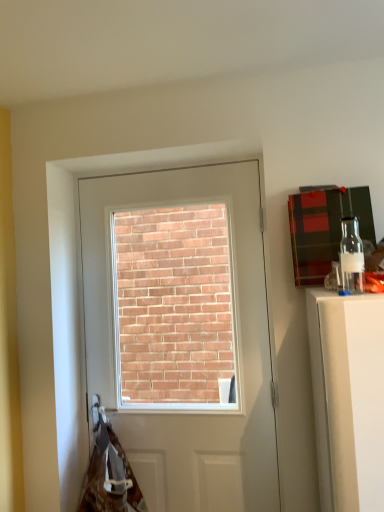
Question: Can you confirm if white glossy door at center is shorter than clear glass bottle at upper right?

Choices:
 (A) no
 (B) yes

Answer: (A)

Question: Does white glossy door at center lie in front of clear glass bottle at upper right?

Choices:
 (A) yes
 (B) no

Answer: (B)

Question: Is white glossy door at center turned away from clear glass bottle at upper right?

Choices:
 (A) no
 (B) yes

Answer: (A)

Question: Can you confirm if white glossy door at center is wider than clear glass bottle at upper right?

Choices:
 (A) yes
 (B) no

Answer: (A)

Question: From the image's perspective, is white glossy door at center above clear glass bottle at upper right?

Choices:
 (A) no
 (B) yes

Answer: (A)

Question: From a real-world perspective, is white glossy door at center positioned over clear glass bottle at upper right based on gravity?

Choices:
 (A) no
 (B) yes

Answer: (A)

Question: Is clear glass bottle at upper right looking in the opposite direction of brown fabric at lower left?

Choices:
 (A) yes
 (B) no

Answer: (B)

Question: From a real-world perspective, is clear glass bottle at upper right located beneath brown fabric at lower left?

Choices:
 (A) yes
 (B) no

Answer: (B)

Question: Considering the relative positions of clear glass bottle at upper right and brown fabric at lower left in the image provided, is clear glass bottle at upper right behind brown fabric at lower left?

Choices:
 (A) no
 (B) yes

Answer: (A)

Question: Is clear glass bottle at upper right beside brown fabric at lower left?

Choices:
 (A) no
 (B) yes

Answer: (A)

Question: Are clear glass bottle at upper right and brown fabric at lower left far apart?

Choices:
 (A) no
 (B) yes

Answer: (B)

Question: From the image's perspective, is clear glass bottle at upper right below brown fabric at lower left?

Choices:
 (A) no
 (B) yes

Answer: (A)

Question: Is the depth of brown fabric at lower left less than that of white glossy door at center?

Choices:
 (A) no
 (B) yes

Answer: (B)